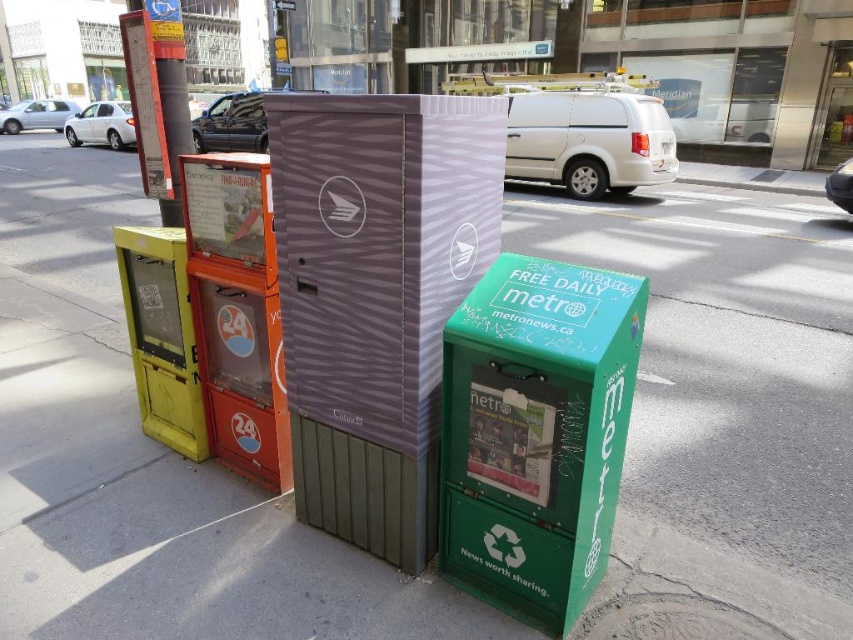
You are a mail carrier delivering packages to the purple striped mailbox at center and the green matte newspaper box at lower right. Which object is located to the right of the other?

The purple striped mailbox at center is positioned on the left side of green matte newspaper box at lower right, so the green matte newspaper box at lower right is to the right of the purple striped mailbox at center.

You are a mail carrier delivering packages. You need to place a package in the closest object to you between the purple striped mailbox at center and the green matte newspaper box at lower right. Which object should you choose?

The purple striped mailbox at center is closer to you than the green matte newspaper box at lower right, so you should choose the purple striped mailbox at center to place the package.